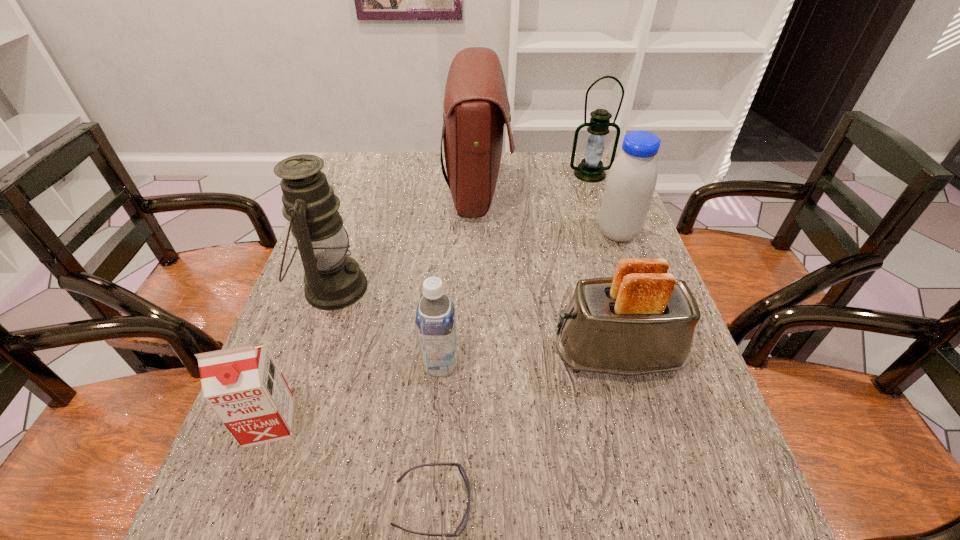
Where is `free spot located on the back of the fourth farthest object`? Image resolution: width=960 pixels, height=540 pixels. free spot located on the back of the fourth farthest object is located at coordinates (364, 195).

You are a GUI agent. You are given a task and a screenshot of the screen. Output one action in this format:
    pyautogui.click(x=<x>, y=<y>)
    Task: Click on the free space located 0.220m on the side where the lantern emits light
    The width and height of the screenshot is (960, 540).
    Given the screenshot: What is the action you would take?
    pyautogui.click(x=607, y=223)

Where is `free spot located on the front of the rightmost soya milk`? This screenshot has width=960, height=540. free spot located on the front of the rightmost soya milk is located at coordinates (663, 361).

Where is `free location located 0.070m on the side of the toaster with the control lever`? Image resolution: width=960 pixels, height=540 pixels. free location located 0.070m on the side of the toaster with the control lever is located at coordinates (520, 355).

This screenshot has width=960, height=540. I want to click on vacant space located on the side of the toaster with the control lever, so click(525, 355).

You are a GUI agent. You are given a task and a screenshot of the screen. Output one action in this format:
    pyautogui.click(x=<x>, y=<y>)
    Task: Click on the blank space located 0.300m on the side of the toaster with the control lever
    The image size is (960, 540).
    Given the screenshot: What is the action you would take?
    pyautogui.click(x=414, y=355)

This screenshot has height=540, width=960. What are the coordinates of `free spot located 0.260m on the label of the second soya milk from right to left` in the screenshot? It's located at [x=580, y=364].

Find the location of a particular element. This screenshot has width=960, height=540. free space located 0.220m on the right of the seventh farthest object is located at coordinates (412, 422).

Image resolution: width=960 pixels, height=540 pixels. In order to click on satchel present at the far edge in this screenshot , I will do `click(476, 106)`.

Find the location of a particular element. The width and height of the screenshot is (960, 540). lantern present at the far edge is located at coordinates (591, 169).